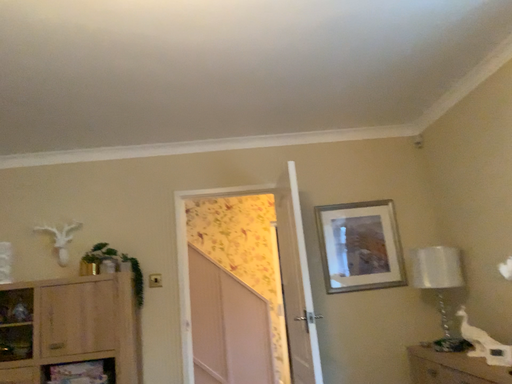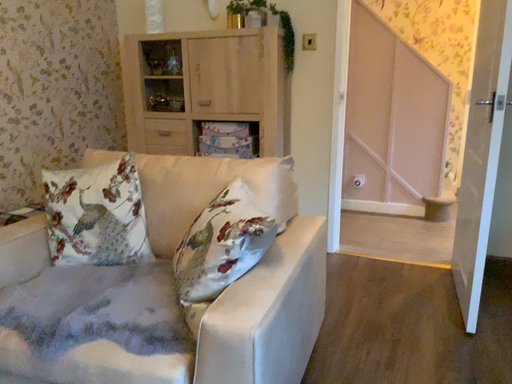
Question: How did the camera likely rotate when shooting the video?

Choices:
 (A) rotated right
 (B) rotated left

Answer: (B)